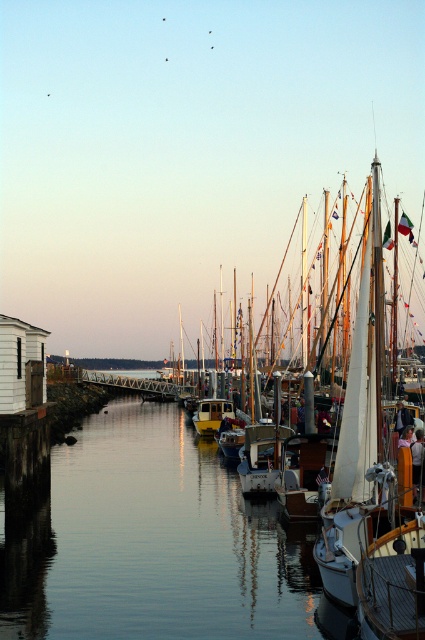
Can you confirm if smooth water at center is thinner than yellow matte boat at center?

No, smooth water at center is not thinner than yellow matte boat at center.

Is smooth water at center closer to the viewer compared to yellow matte boat at center?

Yes, smooth water at center is closer to the viewer.

Where is `smooth water at center`? Image resolution: width=425 pixels, height=640 pixels. smooth water at center is located at coordinates (156, 544).